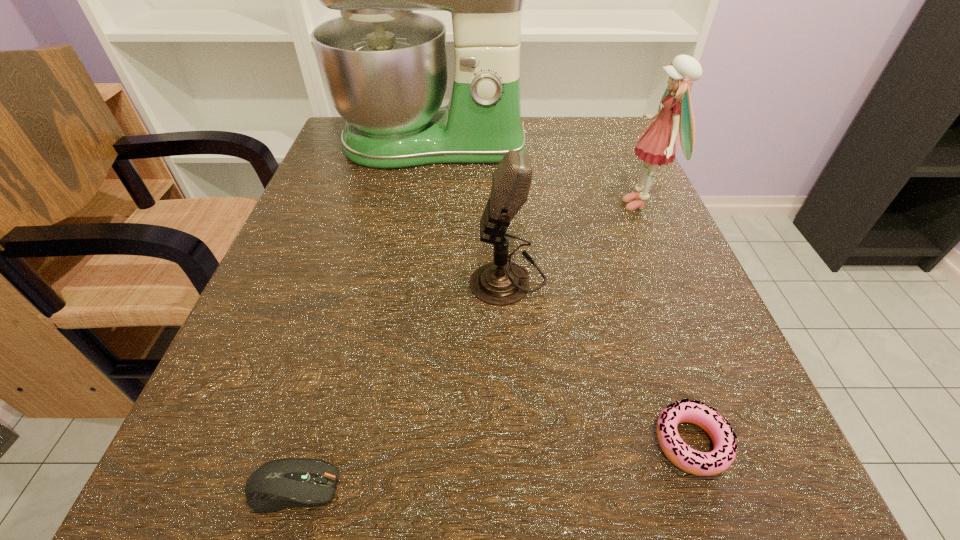
Identify the location of the tallest object. (384, 67).

You are a GUI agent. You are given a task and a screenshot of the screen. Output one action in this format:
    pyautogui.click(x=<x>, y=<y>)
    Task: Click on the mixer
    
    Given the screenshot: What is the action you would take?
    pyautogui.click(x=384, y=67)

In order to click on the second tallest object in this screenshot , I will do `click(659, 143)`.

This screenshot has height=540, width=960. Find the location of `the second farthest object`. the second farthest object is located at coordinates (659, 143).

Locate an element on the screen. The width and height of the screenshot is (960, 540). the third shortest object is located at coordinates (499, 283).

The width and height of the screenshot is (960, 540). In order to click on microphone in this screenshot , I will do `click(499, 283)`.

Locate an element on the screen. The height and width of the screenshot is (540, 960). computer equipment is located at coordinates (278, 484).

The height and width of the screenshot is (540, 960). I want to click on doughnut, so click(x=689, y=460).

Where is `free region located 0.130m on the controls of the mixer`? free region located 0.130m on the controls of the mixer is located at coordinates (421, 213).

This screenshot has height=540, width=960. In order to click on free space located 0.270m on the front-facing side of the doll in this screenshot , I will do `click(470, 204)`.